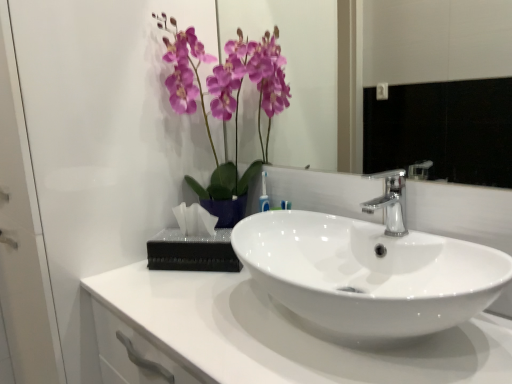
Question: Is transparent glass door at upper left closer to the viewer compared to translucent plastic tissue at center?

Choices:
 (A) yes
 (B) no

Answer: (A)

Question: Is transparent glass door at upper left at the left side of translucent plastic tissue at center?

Choices:
 (A) yes
 (B) no

Answer: (A)

Question: Is transparent glass door at upper left bigger than translucent plastic tissue at center?

Choices:
 (A) yes
 (B) no

Answer: (A)

Question: From a real-world perspective, is transparent glass door at upper left positioned over translucent plastic tissue at center based on gravity?

Choices:
 (A) yes
 (B) no

Answer: (B)

Question: Is transparent glass door at upper left positioned far away from translucent plastic tissue at center?

Choices:
 (A) yes
 (B) no

Answer: (B)

Question: Is transparent glass door at upper left oriented away from translucent plastic tissue at center?

Choices:
 (A) no
 (B) yes

Answer: (A)

Question: Is glossy ceramic mirror at upper center beside purple glossy orchid at upper center?

Choices:
 (A) no
 (B) yes

Answer: (A)

Question: Is glossy ceramic mirror at upper center wider than purple glossy orchid at upper center?

Choices:
 (A) no
 (B) yes

Answer: (A)

Question: From the image's perspective, is glossy ceramic mirror at upper center beneath purple glossy orchid at upper center?

Choices:
 (A) yes
 (B) no

Answer: (B)

Question: Does glossy ceramic mirror at upper center have a lesser height compared to purple glossy orchid at upper center?

Choices:
 (A) no
 (B) yes

Answer: (B)

Question: Is purple glossy orchid at upper center surrounded by glossy ceramic mirror at upper center?

Choices:
 (A) no
 (B) yes

Answer: (A)

Question: Can you confirm if glossy ceramic mirror at upper center is positioned to the right of purple glossy orchid at upper center?

Choices:
 (A) yes
 (B) no

Answer: (A)

Question: Can you confirm if white glossy countertop at center is bigger than satin nickel faucet at center?

Choices:
 (A) yes
 (B) no

Answer: (A)